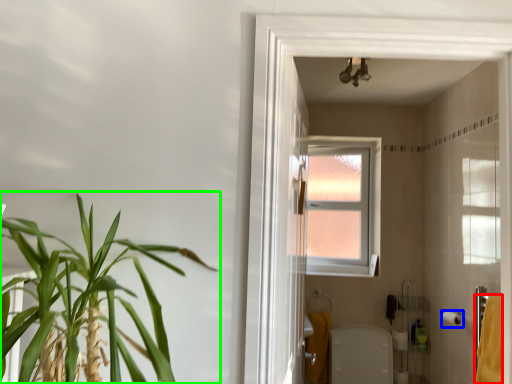
Question: Estimate the real-world distances between objects in this image. Which object is closer to bath towel (highlighted by a red box), toilet paper (highlighted by a blue box) or houseplant (highlighted by a green box)?

Choices:
 (A) toilet paper
 (B) houseplant

Answer: (A)